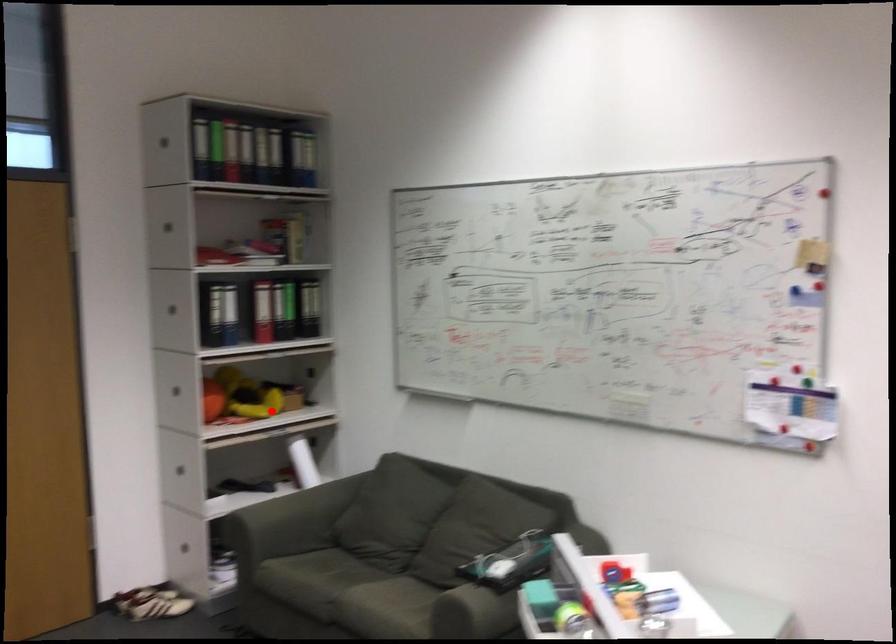
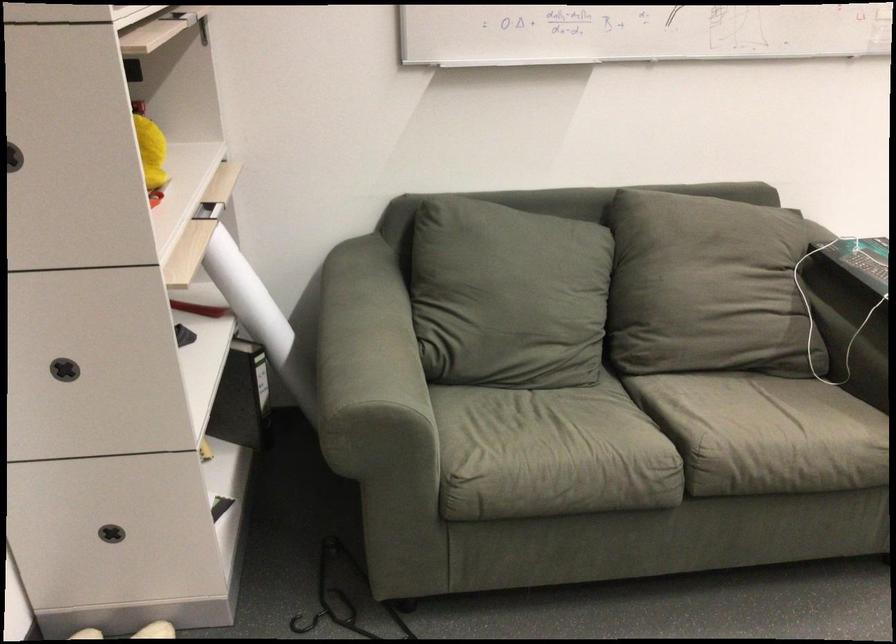
In the second image, find the point that corresponds to the highlighted location in the first image.

(151, 152)